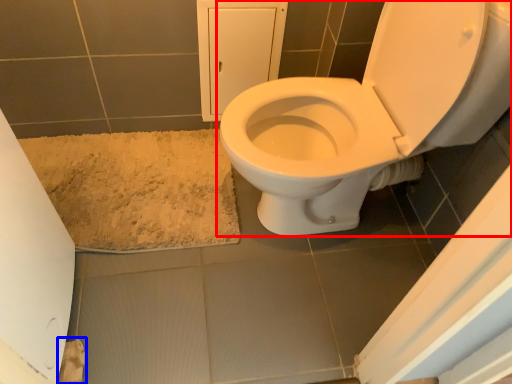
Question: Which of the following is the closest to the observer, toilet (highlighted by a red box) or toilet paper (highlighted by a blue box)?

Choices:
 (A) toilet
 (B) toilet paper

Answer: (A)